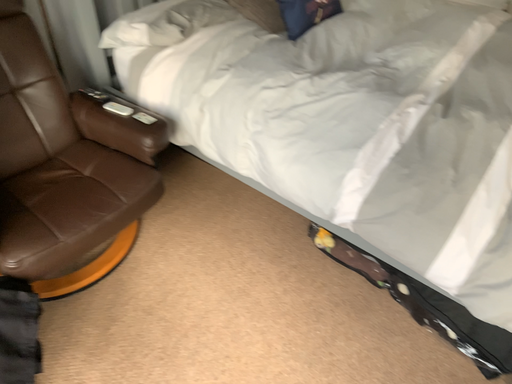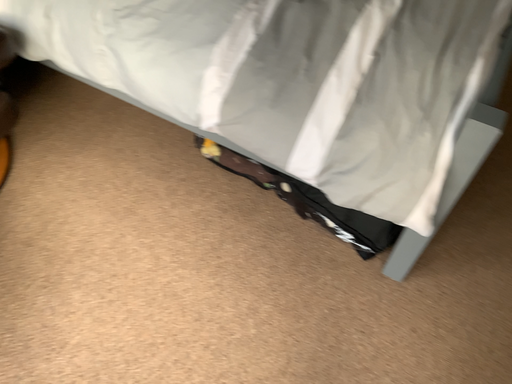
Question: How did the camera likely rotate when shooting the video?

Choices:
 (A) rotated upward
 (B) rotated downward

Answer: (B)